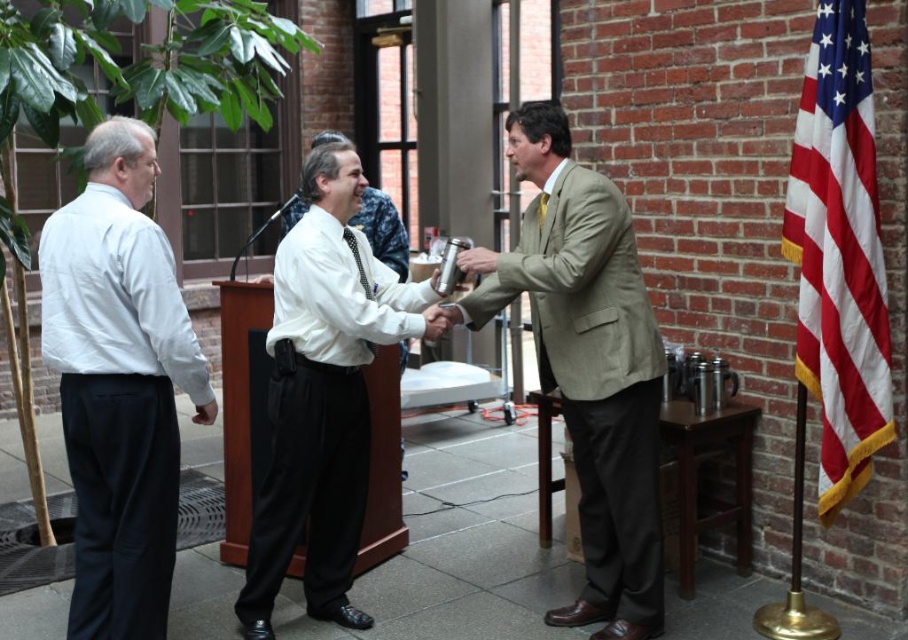
Is white cotton shirt at left positioned at the back of matte black tie at center?

No, it is in front of matte black tie at center.

Does point (77, 387) come farther from viewer compared to point (541, 214)?

No, (77, 387) is closer to viewer.

Image resolution: width=908 pixels, height=640 pixels. What are the coordinates of `white cotton shirt at left` in the screenshot? It's located at (119, 384).

Is point (86, 310) farther from viewer compared to point (489, 262)?

No, it is not.

Who is shorter, white cotton shirt at left or metallic silver cup at center?

metallic silver cup at center

The image size is (908, 640). Describe the element at coordinates (119, 384) in the screenshot. I see `white cotton shirt at left` at that location.

The height and width of the screenshot is (640, 908). What are the coordinates of `white cotton shirt at left` in the screenshot? It's located at (119, 384).

Can you confirm if matte beige suit at center is bigger than metallic silver cup at center?

Yes, matte beige suit at center is bigger than metallic silver cup at center.

Between point (543, 372) and point (482, 266), which one is positioned in front?

Point (482, 266) is more forward.

Does point (591, 492) come in front of point (457, 259)?

No, (591, 492) is further to viewer.

Locate an element on the screen. matte beige suit at center is located at coordinates (590, 365).